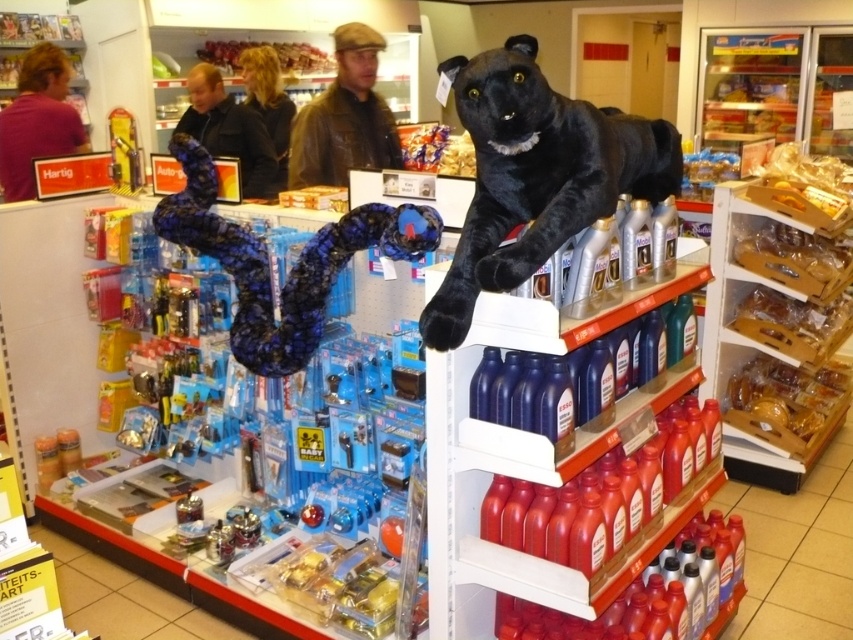
Who is higher up, blue fabric snake at center or dark brown leather jacket at upper center?

dark brown leather jacket at upper center is higher up.

Looking at this image, can you confirm if blue fabric snake at center is wider than dark brown leather jacket at upper center?

Correct, the width of blue fabric snake at center exceeds that of dark brown leather jacket at upper center.

Which is in front, point (352, 212) or point (218, 120)?

Positioned in front is point (352, 212).

This screenshot has height=640, width=853. Identify the location of blue fabric snake at center. (292, 266).

Can you confirm if blue glossy bottle at center is thinner than leather cap at center?

Incorrect, blue glossy bottle at center's width is not less than leather cap at center's.

From the picture: Who is taller, blue glossy bottle at center or leather cap at center?

With more height is leather cap at center.

Locate an element on the screen. Image resolution: width=853 pixels, height=640 pixels. blue glossy bottle at center is located at coordinates (582, 374).

Locate an element on the screen. This screenshot has width=853, height=640. blue glossy bottle at center is located at coordinates (582, 374).

Is blue glossy bottle at center behind dark brown leather jacket at upper center?

No, it is in front of dark brown leather jacket at upper center.

You are a GUI agent. You are given a task and a screenshot of the screen. Output one action in this format:
    pyautogui.click(x=<x>, y=<y>)
    Task: Click on the blue glossy bottle at center
    
    Given the screenshot: What is the action you would take?
    pyautogui.click(x=582, y=374)